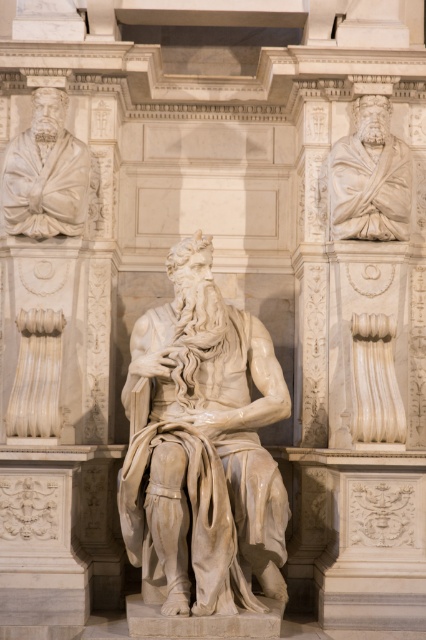
Is white marble statue at upper left above white marble bust at upper right?

Yes, white marble statue at upper left is above white marble bust at upper right.

Between white marble statue at upper left and white marble bust at upper right, which one appears on the left side from the viewer's perspective?

white marble statue at upper left is more to the left.

Does point (83, 152) come behind point (377, 144)?

Yes, point (83, 152) is farther from viewer.

Identify the location of white marble statue at upper left. (46, 173).

Is white marble statue at center thinner than white marble statue at upper left?

Incorrect, white marble statue at center's width is not less than white marble statue at upper left's.

Does point (155, 381) come behind point (89, 172)?

That is False.

This screenshot has width=426, height=640. What are the coordinates of `white marble statue at center` in the screenshot? It's located at (204, 449).

Does white marble statue at center appear on the left side of white marble bust at upper right?

Yes, white marble statue at center is to the left of white marble bust at upper right.

The height and width of the screenshot is (640, 426). I want to click on white marble statue at center, so click(204, 449).